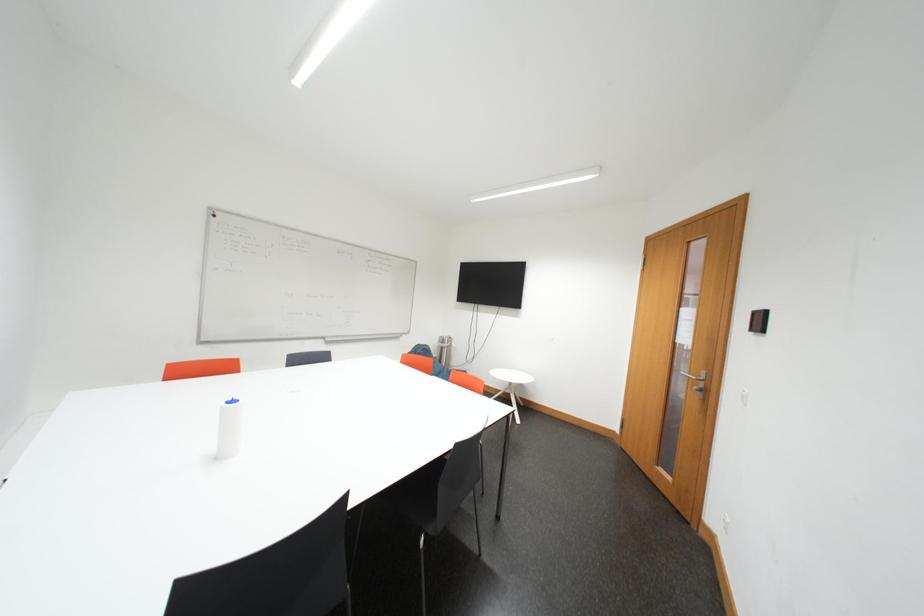
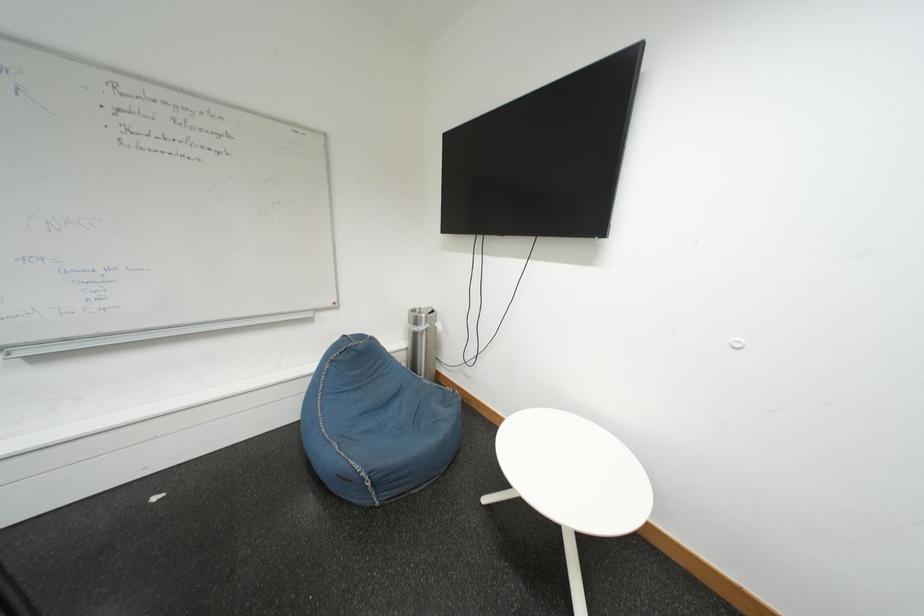
Question: The images are taken continuously from a first-person perspective. In which direction are you moving?

Choices:
 (A) Left
 (B) Right
 (C) Forward
 (D) Backward

Answer: (C)